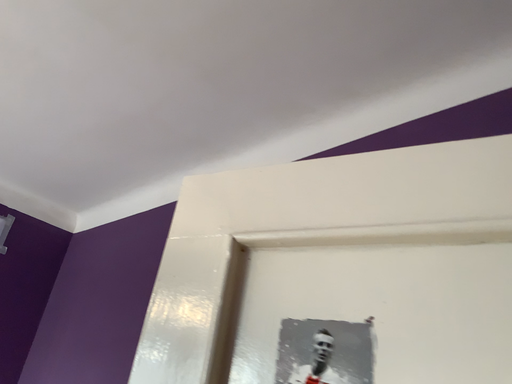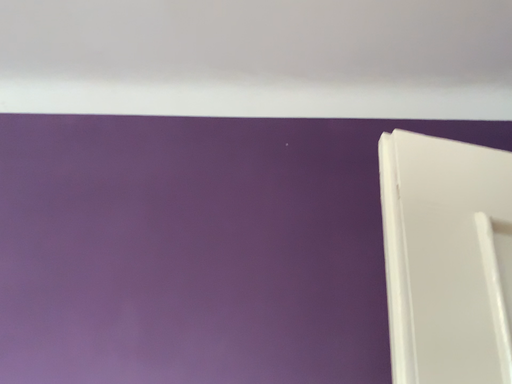
Question: How did the camera likely rotate when shooting the video?

Choices:
 (A) rotated upward
 (B) rotated downward

Answer: (B)